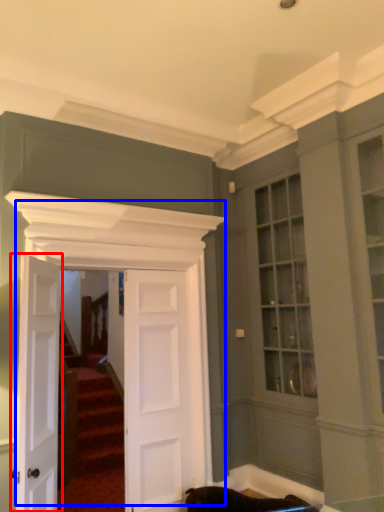
Question: Which object is further to the camera taking this photo, door (highlighted by a red box) or door (highlighted by a blue box)?

Choices:
 (A) door
 (B) door

Answer: (B)